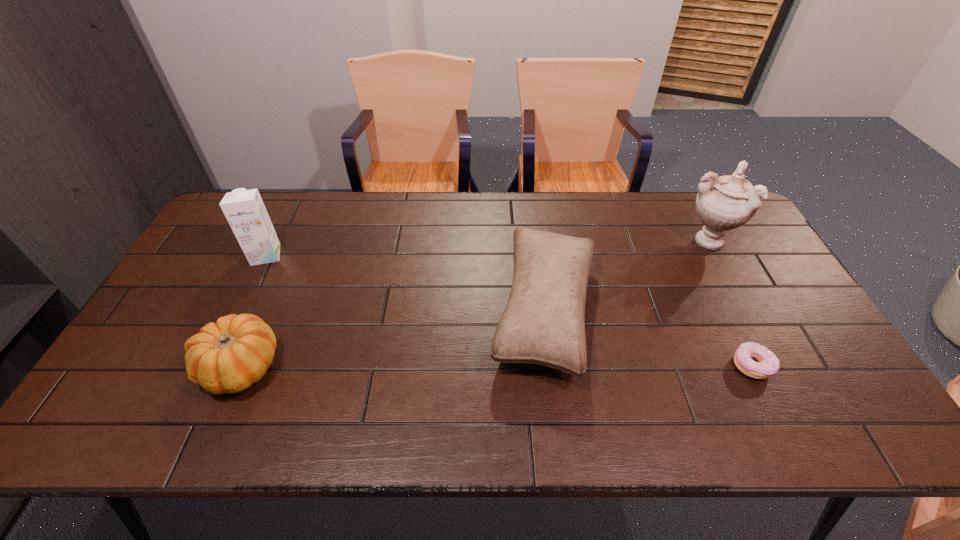
At what (x,y) coordinates should I click in order to perform the action: click on urn. Please return your answer as a coordinate pair (x, y). The height and width of the screenshot is (540, 960). Looking at the image, I should click on (723, 203).

Locate an element on the screen. carton is located at coordinates (244, 210).

In order to click on cushion in this screenshot , I will do `click(543, 323)`.

At what (x,y) coordinates should I click in order to perform the action: click on the third shortest object. Please return your answer as a coordinate pair (x, y). Image resolution: width=960 pixels, height=540 pixels. Looking at the image, I should click on (543, 323).

Where is `gourd`? The image size is (960, 540). gourd is located at coordinates (229, 356).

Identify the location of doughnut. This screenshot has height=540, width=960. (768, 364).

Where is `free space located on the left of the urn`? The image size is (960, 540). free space located on the left of the urn is located at coordinates (555, 241).

Image resolution: width=960 pixels, height=540 pixels. I want to click on vacant position located on the right of the carton, so click(389, 255).

Where is `vacant area located on the back of the third object from left to right`? Image resolution: width=960 pixels, height=540 pixels. vacant area located on the back of the third object from left to right is located at coordinates (533, 219).

The image size is (960, 540). In order to click on vacant area located 0.280m on the right of the gourd in this screenshot , I will do `click(394, 367)`.